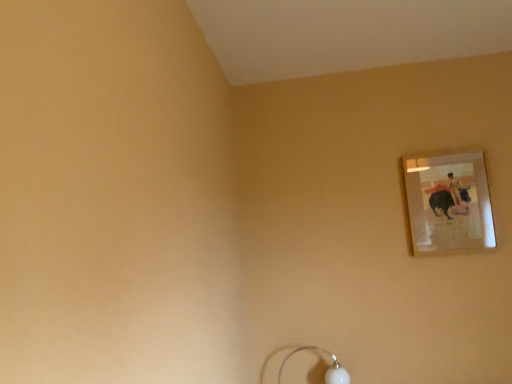
Question: Is matte glass picture frame at upper right bigger or smaller than white glossy lamp at lower center?

Choices:
 (A) big
 (B) small

Answer: (B)

Question: Would you say matte glass picture frame at upper right is inside or outside white glossy lamp at lower center?

Choices:
 (A) outside
 (B) inside

Answer: (A)

Question: Considering the positions of matte glass picture frame at upper right and white glossy lamp at lower center in the image, is matte glass picture frame at upper right wider or thinner than white glossy lamp at lower center?

Choices:
 (A) wide
 (B) thin

Answer: (B)

Question: Is white glossy lamp at lower center inside or outside of matte glass picture frame at upper right?

Choices:
 (A) inside
 (B) outside

Answer: (B)

Question: Based on their positions, is white glossy lamp at lower center located to the left or right of matte glass picture frame at upper right?

Choices:
 (A) right
 (B) left

Answer: (B)

Question: Is white glossy lamp at lower center wider or thinner than matte glass picture frame at upper right?

Choices:
 (A) wide
 (B) thin

Answer: (A)

Question: Relative to matte glass picture frame at upper right, is white glossy lamp at lower center in front or behind?

Choices:
 (A) behind
 (B) front

Answer: (B)